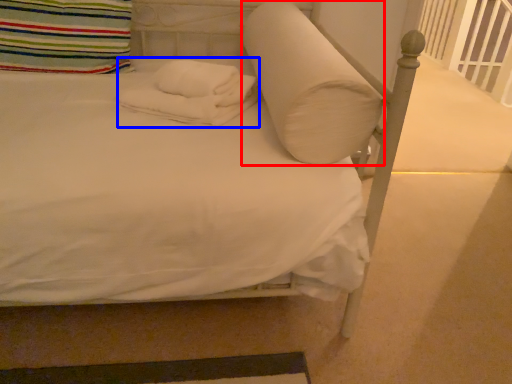
Question: Which object appears closest to the camera in this image, pillow (highlighted by a red box) or material (highlighted by a blue box)?

Choices:
 (A) pillow
 (B) material

Answer: (A)